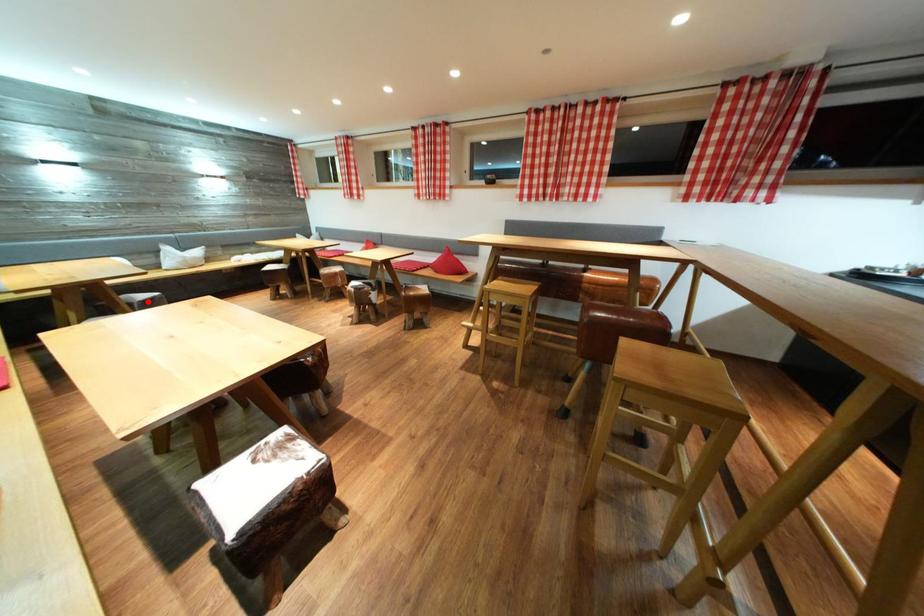
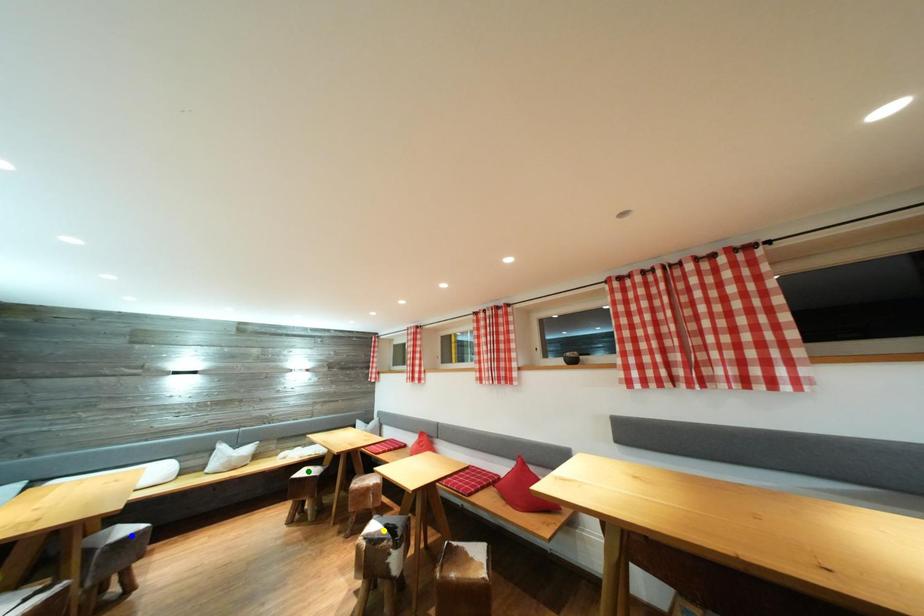
Question: I am providing you with two images of the same scene from different viewpoints. A red point is marked on the first image. You are given multiple points on the second image. Which point in image 2 is actually the same real-world point as the red point in image 1?

Choices:
 (A) green point
 (B) blue point
 (C) yellow point

Answer: (B)